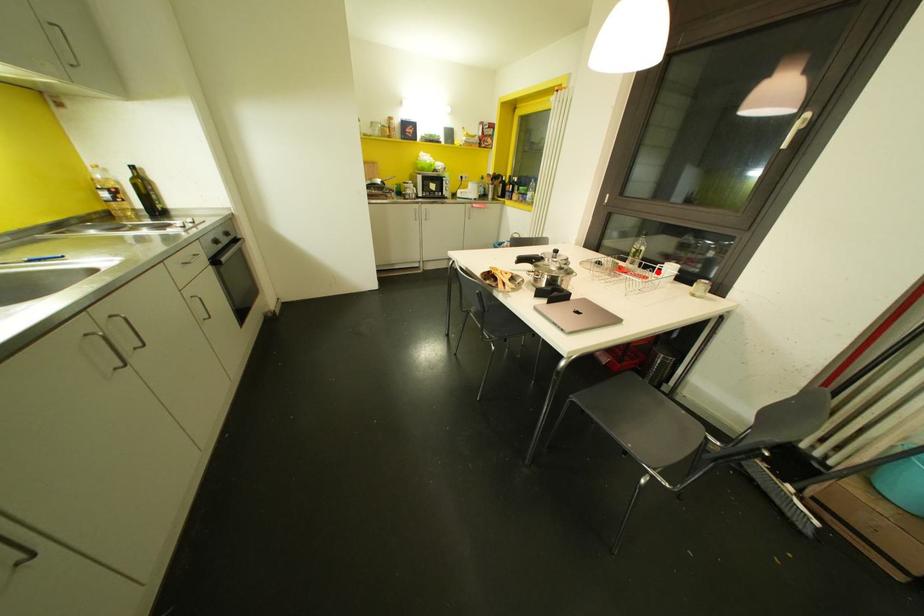
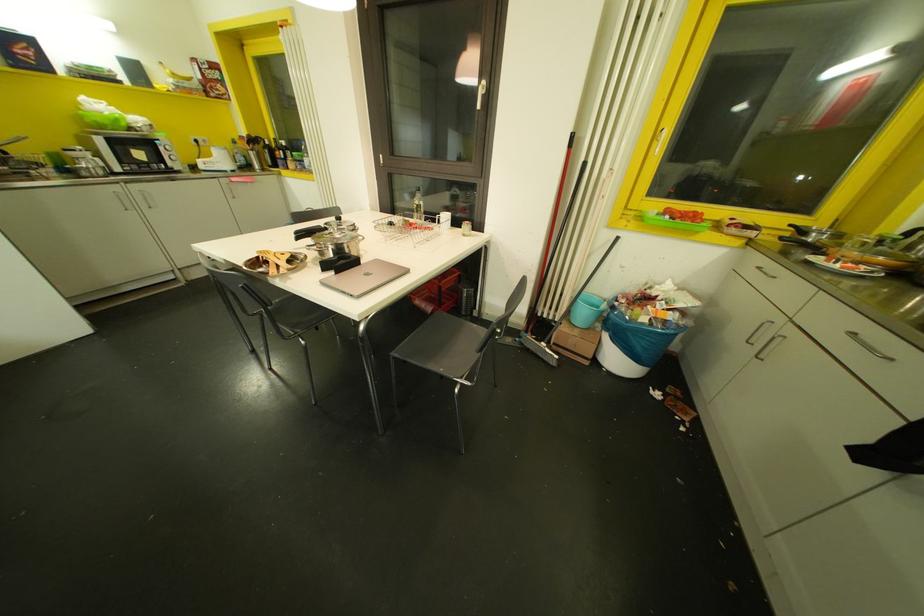
Question: I am providing you with two images of the same scene from different viewpoints. Image1 has a red point marked. In image2, the corresponding 3D location appears at what relative position? Reply with the corresponding letter.

Choices:
 (A) Closer
 (B) Farther

Answer: (A)